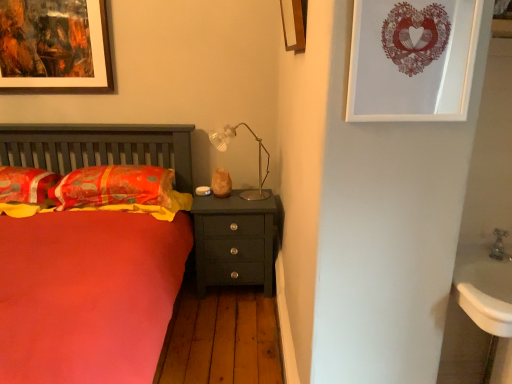
Question: Considering the positions of metallic silver faucet at lower right and matte paper picture frame at upper right, which ranks as the 1th picture frame in right-to-left order, in the image, is metallic silver faucet at lower right taller or shorter than matte paper picture frame at upper right, which ranks as the 1th picture frame in right-to-left order,?

Choices:
 (A) short
 (B) tall

Answer: (A)

Question: Is metallic silver faucet at lower right wider or thinner than matte paper picture frame at upper right, which ranks as the 1th picture frame in right-to-left order?

Choices:
 (A) thin
 (B) wide

Answer: (B)

Question: Which object is the farthest from the velvety orange pillow at left, which ranks as the 2th pillow in left-to-right order?

Choices:
 (A) matte dark green nightstand at center
 (B) gold metallic table lamp at center
 (C) wooden picture frame at upper center, which appears as the 2th picture frame when viewed from the front
 (D) matte orange blanket at left
 (E) matte paper picture frame at upper right, which ranks as the 1th picture frame in right-to-left order

Answer: (E)

Question: Estimate the real-world distances between objects in this image. Which object is farther from the white glossy sink at lower right?

Choices:
 (A) matte paper picture frame at upper right, which ranks as the 1th picture frame in right-to-left order
 (B) velvety orange pillow at left, the 1th pillow positioned from the right
 (C) gold metallic table lamp at center
 (D) matte orange pillow at left, which is the 2th pillow from right to left
 (E) wooden picture frame at upper center, the 2th picture frame in the left-to-right sequence

Answer: (D)